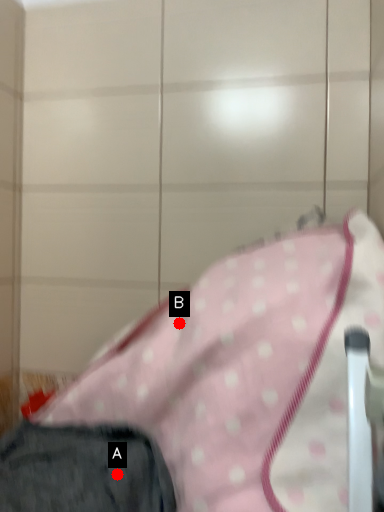
Question: Two points are circled on the image, labeled by A and B beside each circle. Which of the following is the farthest from the observer?

Choices:
 (A) A is further
 (B) B is further

Answer: (B)